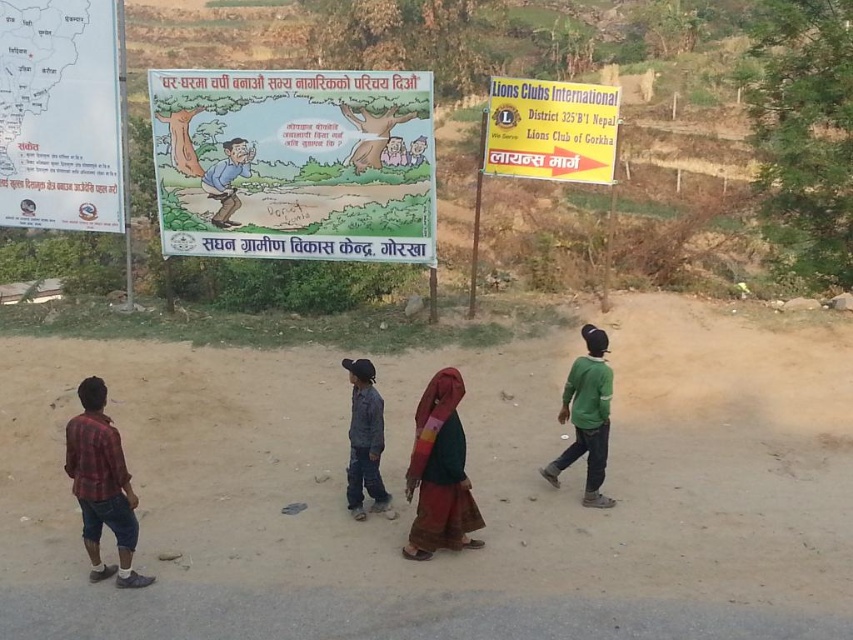
Question: Which is nearer to the plaid fabric shirt at left?

Choices:
 (A) yellow paper sign at upper right
 (B) denim pants at center
 (C) matte paper poster at center

Answer: (B)

Question: Which of the following is the closest to the observer?

Choices:
 (A) plaid fabric shirt at left
 (B) multicolored fabric dress at center
 (C) yellow paper sign at upper right

Answer: (A)

Question: Does brown sandy dirt field at lower center appear on the left side of green matte shirt at right?

Choices:
 (A) yes
 (B) no

Answer: (A)

Question: Which object is closer to the camera taking this photo?

Choices:
 (A) white paper map at upper left
 (B) denim pants at center
 (C) plaid fabric shirt at left
 (D) yellow paper sign at upper right

Answer: (C)

Question: Does matte paper poster at center appear over plaid fabric shirt at left?

Choices:
 (A) no
 (B) yes

Answer: (B)

Question: Considering the relative positions of matte paper poster at center and multicolored fabric dress at center in the image provided, where is matte paper poster at center located with respect to multicolored fabric dress at center?

Choices:
 (A) right
 (B) left

Answer: (B)